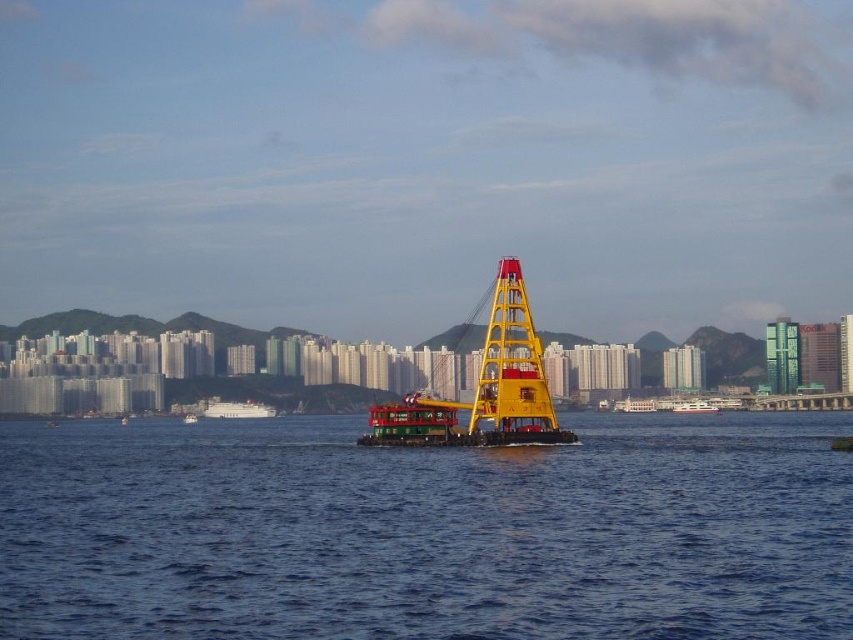
Question: Observing the image, what is the correct spatial positioning of white matte boat at center in reference to white glossy ferry at center?

Choices:
 (A) left
 (B) right

Answer: (A)

Question: Is white matte boat at center smaller than white glossy ferry at center?

Choices:
 (A) yes
 (B) no

Answer: (B)

Question: In this image, where is white matte boat at center located relative to white glossy ferry at center?

Choices:
 (A) above
 (B) below

Answer: (B)

Question: Among these objects, which one is farthest from the camera?

Choices:
 (A) white glossy ferry at center
 (B) yellow metallic crane at center
 (C) white matte boat at center

Answer: (C)

Question: Among these objects, which one is farthest from the camera?

Choices:
 (A) white glossy ferry at center
 (B) blue water at center
 (C) white matte boat at center
 (D) yellow metallic crane at center

Answer: (C)

Question: Which point is closer to the camera taking this photo?

Choices:
 (A) (827, 548)
 (B) (218, 416)
 (C) (683, 412)
 (D) (543, 378)

Answer: (A)